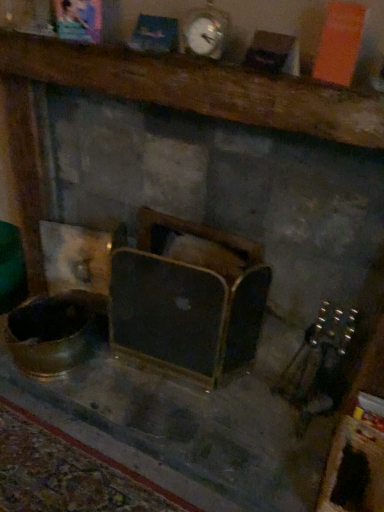
At what (x,y) coordinates should I click in order to perform the action: click on metallic silver clock at upper center. Please return your answer as a coordinate pair (x, y). The image size is (384, 512). Looking at the image, I should click on (204, 31).

Measure the distance between point (207, 30) and camera.

Point (207, 30) and camera are 3.89 feet apart from each other.

Find the location of a particular element. This screenshot has width=384, height=512. wooden framed mirror at center, which is counted as the 2th furniture, starting from the top is located at coordinates (187, 302).

What do you see at coordinates (200, 88) in the screenshot? I see `wooden mantel at upper center, which is the first furniture from top to bottom` at bounding box center [200, 88].

Measure the distance between point (189,109) and camera.

1.21 meters.

Locate an element on the screen. Image resolution: width=384 pixels, height=512 pixels. metallic silver clock at upper center is located at coordinates (204, 31).

Does wooden framed mirror at center, which is counted as the 2th furniture, starting from the top, turn towards metallic silver clock at upper center?

No, wooden framed mirror at center, which is counted as the 2th furniture, starting from the top, is not facing towards metallic silver clock at upper center.

Between wooden framed mirror at center, which is counted as the 2th furniture, starting from the top, and metallic silver clock at upper center, which one is positioned in front?

metallic silver clock at upper center is more forward.

From the picture: From the image's perspective, is wooden framed mirror at center, placed as the first furniture when sorted from bottom to top, on metallic silver clock at upper center?

Answer: No, from the image's perspective, wooden framed mirror at center, placed as the first furniture when sorted from bottom to top, is not on top of metallic silver clock at upper center.

Can metallic silver clock at upper center be found inside wooden framed mirror at center, placed as the first furniture when sorted from bottom to top?

No, metallic silver clock at upper center is not a part of wooden framed mirror at center, placed as the first furniture when sorted from bottom to top.

From a real-world perspective, is wooden mantel at upper center, which is counted as the 2th furniture, starting from the bottom, on top of metallic silver clock at upper center?

Incorrect, from a real-world perspective, wooden mantel at upper center, which is counted as the 2th furniture, starting from the bottom, is lower than metallic silver clock at upper center.

Looking at this image, which object is closer to the camera, wooden mantel at upper center, which is the first furniture from top to bottom, or metallic silver clock at upper center?

wooden mantel at upper center, which is the first furniture from top to bottom, is in front.

Considering the sizes of objects wooden mantel at upper center, which is the first furniture from top to bottom, and metallic silver clock at upper center in the image provided, who is taller, wooden mantel at upper center, which is the first furniture from top to bottom, or metallic silver clock at upper center?

Standing taller between the two is metallic silver clock at upper center.

Which is closer, [16,69] or [204,40]?

The point [204,40] is closer.

Where is `furniture located behind the wooden mantel at upper center, which is counted as the 2th furniture, starting from the bottom`? The image size is (384, 512). furniture located behind the wooden mantel at upper center, which is counted as the 2th furniture, starting from the bottom is located at coordinates (187, 302).

Considering the relative sizes of wooden mantel at upper center, which is counted as the 2th furniture, starting from the bottom, and wooden framed mirror at center, which is counted as the 2th furniture, starting from the top, in the image provided, is wooden mantel at upper center, which is counted as the 2th furniture, starting from the bottom, thinner than wooden framed mirror at center, which is counted as the 2th furniture, starting from the top,?

Incorrect, the width of wooden mantel at upper center, which is counted as the 2th furniture, starting from the bottom, is not less than that of wooden framed mirror at center, which is counted as the 2th furniture, starting from the top.

Is wooden mantel at upper center, which is the first furniture from top to bottom, aimed at wooden framed mirror at center, which is counted as the 2th furniture, starting from the top?

No.

Is metallic silver clock at upper center far from wooden framed mirror at center, which is counted as the 2th furniture, starting from the top?

No, metallic silver clock at upper center is in close proximity to wooden framed mirror at center, which is counted as the 2th furniture, starting from the top.

From the picture: Would you say metallic silver clock at upper center is inside or outside wooden framed mirror at center, placed as the first furniture when sorted from bottom to top?

metallic silver clock at upper center cannot be found inside wooden framed mirror at center, placed as the first furniture when sorted from bottom to top.

From the picture: Which object is thinner, metallic silver clock at upper center or wooden framed mirror at center, placed as the first furniture when sorted from bottom to top?

Thinner between the two is metallic silver clock at upper center.

In the scene shown: How different are the orientations of metallic silver clock at upper center and wooden framed mirror at center, placed as the first furniture when sorted from bottom to top, in degrees?

The angle between the facing direction of metallic silver clock at upper center and the facing direction of wooden framed mirror at center, placed as the first furniture when sorted from bottom to top, is 0.466 degrees.

Considering the positions of objects wooden framed mirror at center, which is counted as the 2th furniture, starting from the top, and wooden mantel at upper center, which is the first furniture from top to bottom, in the image provided, who is more to the left, wooden framed mirror at center, which is counted as the 2th furniture, starting from the top, or wooden mantel at upper center, which is the first furniture from top to bottom,?

wooden framed mirror at center, which is counted as the 2th furniture, starting from the top, is more to the left.

From a real-world perspective, is wooden framed mirror at center, which is counted as the 2th furniture, starting from the top, physically located above or below wooden mantel at upper center, which is the first furniture from top to bottom?

wooden framed mirror at center, which is counted as the 2th furniture, starting from the top, is below wooden mantel at upper center, which is the first furniture from top to bottom.

Can you confirm if wooden framed mirror at center, which is counted as the 2th furniture, starting from the top, is wider than wooden mantel at upper center, which is the first furniture from top to bottom?

No, wooden framed mirror at center, which is counted as the 2th furniture, starting from the top, is not wider than wooden mantel at upper center, which is the first furniture from top to bottom.

Considering the sizes of objects metallic silver clock at upper center and wooden mantel at upper center, which is counted as the 2th furniture, starting from the bottom, in the image provided, who is taller, metallic silver clock at upper center or wooden mantel at upper center, which is counted as the 2th furniture, starting from the bottom,?

Standing taller between the two is metallic silver clock at upper center.

This screenshot has height=512, width=384. Find the location of `clock located on the right of wooden mantel at upper center, which is counted as the 2th furniture, starting from the bottom`. clock located on the right of wooden mantel at upper center, which is counted as the 2th furniture, starting from the bottom is located at coordinates (204, 31).

From the image's perspective, relative to wooden mantel at upper center, which is counted as the 2th furniture, starting from the bottom, is metallic silver clock at upper center above or below?

Based on their image positions, metallic silver clock at upper center is located above wooden mantel at upper center, which is counted as the 2th furniture, starting from the bottom.

At what (x,y) coordinates should I click in order to perform the action: click on the 2nd furniture below the metallic silver clock at upper center (from the image's perspective). Please return your answer as a coordinate pair (x, y). Image resolution: width=384 pixels, height=512 pixels. Looking at the image, I should click on (187, 302).

Which furniture is the 1st one when counting from the left side of the metallic silver clock at upper center? Please provide its 2D coordinates.

[(200, 88)]

Based on their spatial positions, is wooden framed mirror at center, placed as the first furniture when sorted from bottom to top, or metallic silver clock at upper center closer to wooden mantel at upper center, which is counted as the 2th furniture, starting from the bottom?

metallic silver clock at upper center is closer to wooden mantel at upper center, which is counted as the 2th furniture, starting from the bottom.

When comparing their distances from wooden mantel at upper center, which is counted as the 2th furniture, starting from the bottom, does metallic silver clock at upper center or wooden framed mirror at center, which is counted as the 2th furniture, starting from the top, seem closer?

Based on the image, metallic silver clock at upper center appears to be nearer to wooden mantel at upper center, which is counted as the 2th furniture, starting from the bottom.

Based on their spatial positions, is wooden mantel at upper center, which is counted as the 2th furniture, starting from the bottom, or wooden framed mirror at center, which is counted as the 2th furniture, starting from the top, closer to metallic silver clock at upper center?

wooden mantel at upper center, which is counted as the 2th furniture, starting from the bottom, is positioned closer to the anchor metallic silver clock at upper center.

Based on their spatial positions, is wooden framed mirror at center, placed as the first furniture when sorted from bottom to top, or wooden mantel at upper center, which is counted as the 2th furniture, starting from the bottom, further from metallic silver clock at upper center?

wooden framed mirror at center, placed as the first furniture when sorted from bottom to top.

From the image, which object appears to be farther from wooden framed mirror at center, placed as the first furniture when sorted from bottom to top, metallic silver clock at upper center or wooden mantel at upper center, which is the first furniture from top to bottom?

Based on the image, metallic silver clock at upper center appears to be further to wooden framed mirror at center, placed as the first furniture when sorted from bottom to top.

From the image, which object appears to be farther from wooden framed mirror at center, placed as the first furniture when sorted from bottom to top, wooden mantel at upper center, which is the first furniture from top to bottom, or metallic silver clock at upper center?

metallic silver clock at upper center is positioned further to the anchor wooden framed mirror at center, placed as the first furniture when sorted from bottom to top.

I want to click on furniture between metallic silver clock at upper center and wooden framed mirror at center, placed as the first furniture when sorted from bottom to top, vertically, so click(x=200, y=88).